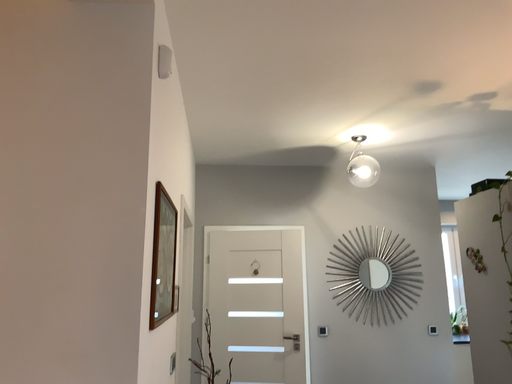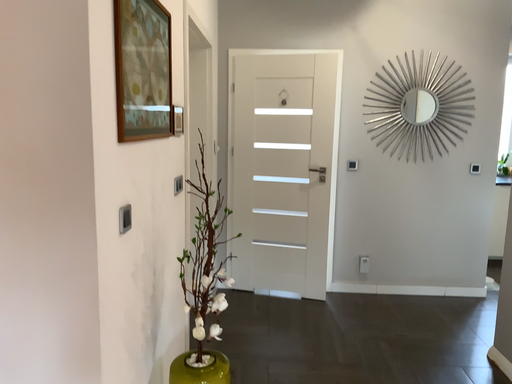
Question: Which way did the camera rotate in the video?

Choices:
 (A) rotated left
 (B) rotated right

Answer: (A)